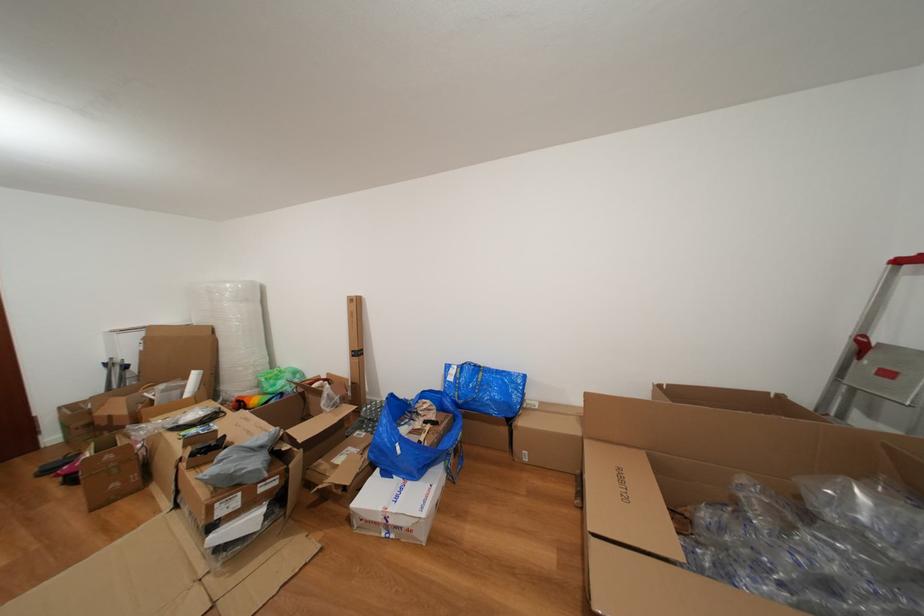
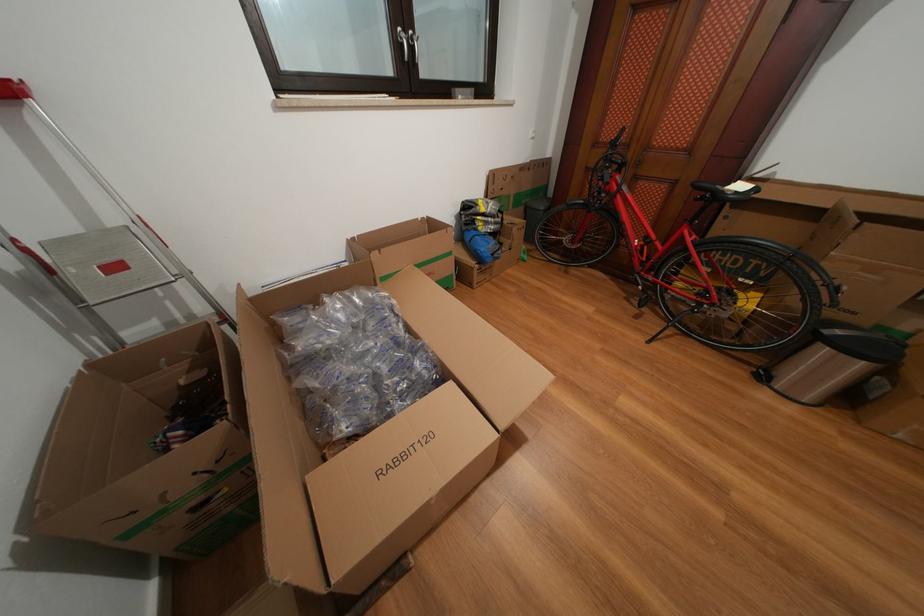
In the second image, find the point that corresponds to (896,379) in the first image.

(124, 273)